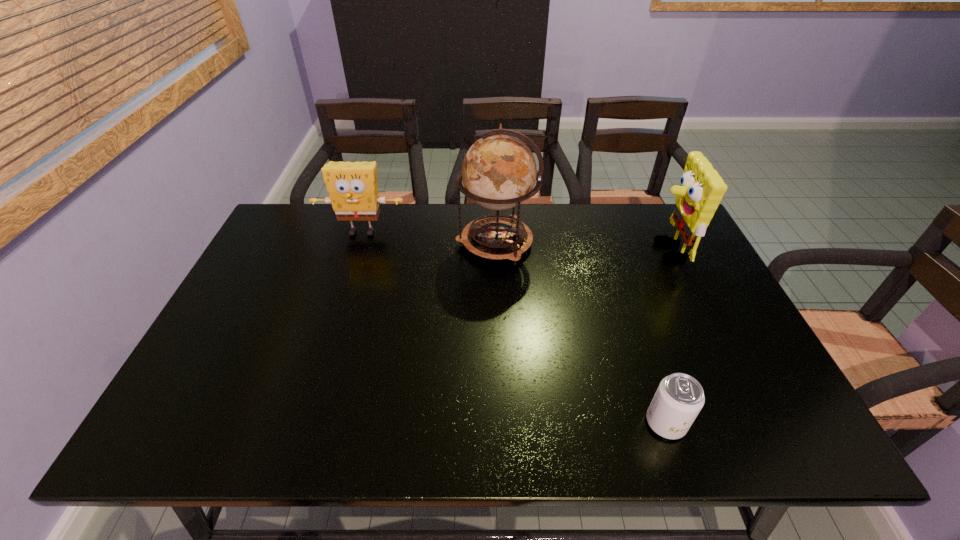
The width and height of the screenshot is (960, 540). Identify the location of vacant space that's between the soda can and the shorter sponge. point(514,327).

Locate an element on the screen. This screenshot has width=960, height=540. blank region between the second object from left to right and the soda can is located at coordinates (581, 333).

The height and width of the screenshot is (540, 960). What are the coordinates of `free spot between the second tallest object and the shortest object` in the screenshot? It's located at (666, 338).

Find the location of a particular element. This screenshot has width=960, height=540. empty space between the third object from left to right and the third tallest object is located at coordinates (514, 327).

Image resolution: width=960 pixels, height=540 pixels. Identify the location of unoccupied area between the third object from right to left and the third tallest object. (429, 238).

At what (x,y) coordinates should I click in order to perform the action: click on vacant area between the globe and the leftmost object. Please return your answer as a coordinate pair (x, y). The image size is (960, 540). Looking at the image, I should click on (429, 238).

The height and width of the screenshot is (540, 960). Find the location of `free spot between the rightmost object and the tallest object`. free spot between the rightmost object and the tallest object is located at coordinates (581, 247).

This screenshot has width=960, height=540. In order to click on vacant area that lies between the third tallest object and the globe in this screenshot , I will do `click(429, 238)`.

The height and width of the screenshot is (540, 960). I want to click on object that is the closest to the tallest object, so click(352, 186).

Locate an element on the screen. This screenshot has height=540, width=960. object that can be found as the second closest to the nearest object is located at coordinates (499, 171).